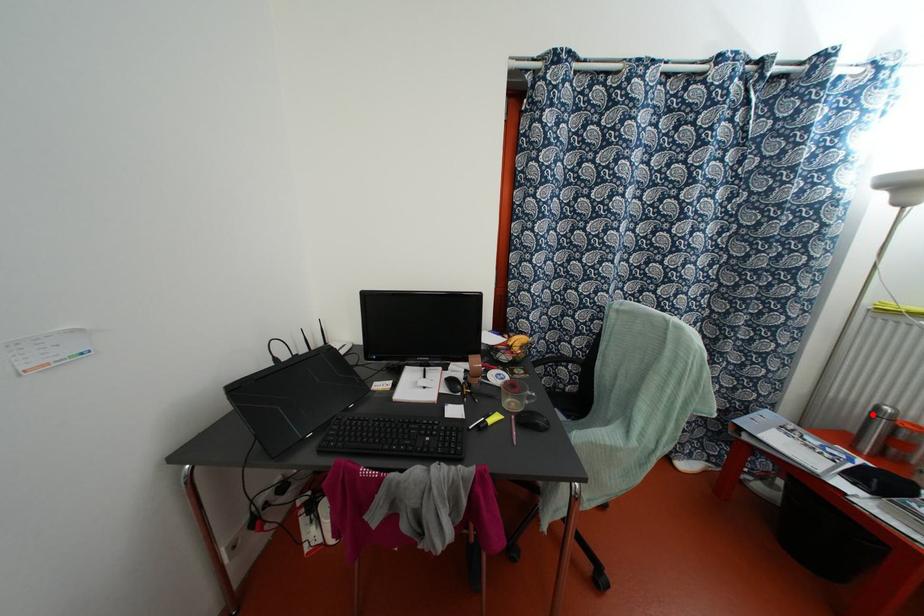
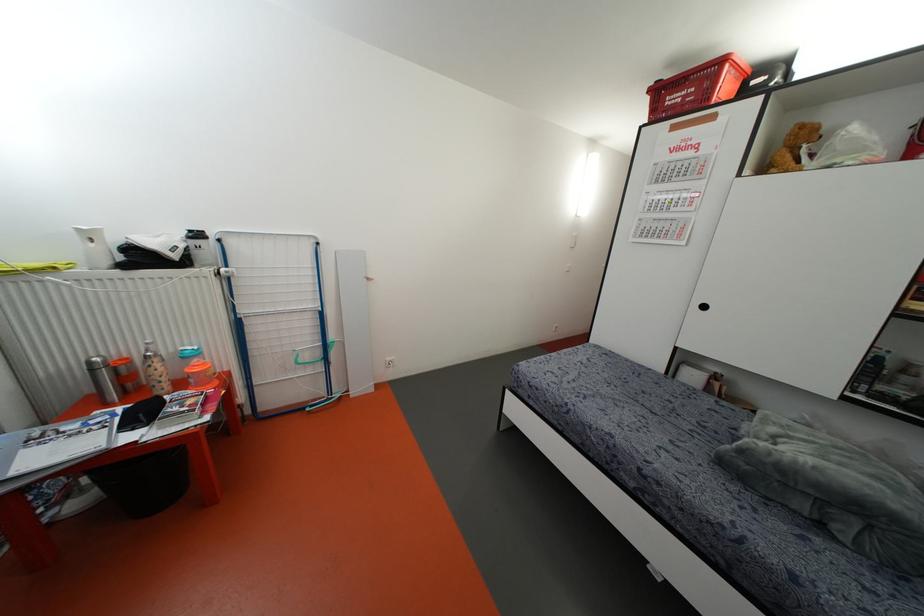
Question: I am providing you with two images of the same scene from different viewpoints. A red point is shown in image1. For the corresponding object point in image2, is it positioned nearer or farther from the camera?

Choices:
 (A) Nearer
 (B) Farther

Answer: (A)